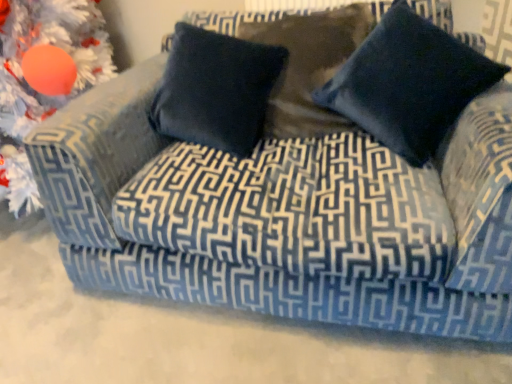
The height and width of the screenshot is (384, 512). What do you see at coordinates (44, 77) in the screenshot?
I see `orange matte ornament at upper left` at bounding box center [44, 77].

Find the location of a particular element. The image size is (512, 384). navy velvet pillow at upper right, the 2th pillow in the left-to-right sequence is located at coordinates (409, 83).

Between navy velvet pillow at upper right, the 2th pillow in the left-to-right sequence, and orange matte ornament at upper left, which one is positioned in front?

navy velvet pillow at upper right, the 2th pillow in the left-to-right sequence, is closer to the camera.

Which object is thinner, navy velvet pillow at upper right, which ranks as the 1th pillow in right-to-left order, or orange matte ornament at upper left?

Thinner between the two is navy velvet pillow at upper right, which ranks as the 1th pillow in right-to-left order.

How different are the orientations of navy velvet pillow at upper right, which ranks as the 1th pillow in right-to-left order, and orange matte ornament at upper left in degrees?

19.2 degrees.

Considering the positions of objects navy velvet pillow at upper right, the 2th pillow in the left-to-right sequence, and orange matte ornament at upper left in the image provided, who is more to the right, navy velvet pillow at upper right, the 2th pillow in the left-to-right sequence, or orange matte ornament at upper left?

navy velvet pillow at upper right, the 2th pillow in the left-to-right sequence, is more to the right.

Who is smaller, navy blue velvet pillow at center, positioned as the second pillow in right-to-left order, or navy velvet pillow at upper right, the 2th pillow in the left-to-right sequence?

navy blue velvet pillow at center, positioned as the second pillow in right-to-left order, is smaller.

Is navy blue velvet pillow at center, the first pillow positioned from the left, shorter than navy velvet pillow at upper right, which ranks as the 1th pillow in right-to-left order?

Yes, navy blue velvet pillow at center, the first pillow positioned from the left, is shorter than navy velvet pillow at upper right, which ranks as the 1th pillow in right-to-left order.

Is navy blue velvet pillow at center, positioned as the second pillow in right-to-left order, at the right side of navy velvet pillow at upper right, the 2th pillow in the left-to-right sequence?

No, navy blue velvet pillow at center, positioned as the second pillow in right-to-left order, is not to the right of navy velvet pillow at upper right, the 2th pillow in the left-to-right sequence.

Which is in front, point (195, 54) or point (59, 68)?

Positioned in front is point (59, 68).

The height and width of the screenshot is (384, 512). In order to click on the 1st pillow located above the orange matte ornament at upper left (from a real-world perspective) in this screenshot , I will do [216, 90].

In terms of height, does navy blue velvet pillow at center, the first pillow positioned from the left, look taller or shorter compared to orange matte ornament at upper left?

In the image, navy blue velvet pillow at center, the first pillow positioned from the left, appears to be shorter than orange matte ornament at upper left.

Would you consider navy blue velvet pillow at center, positioned as the second pillow in right-to-left order, to be distant from orange matte ornament at upper left?

They are positioned close to each other.

Does navy velvet pillow at upper right, the 2th pillow in the left-to-right sequence, appear on the left side of navy blue velvet pillow at center, the first pillow positioned from the left?

Incorrect, navy velvet pillow at upper right, the 2th pillow in the left-to-right sequence, is not on the left side of navy blue velvet pillow at center, the first pillow positioned from the left.

Between navy velvet pillow at upper right, the 2th pillow in the left-to-right sequence, and navy blue velvet pillow at center, the first pillow positioned from the left, which one has larger width?

navy velvet pillow at upper right, the 2th pillow in the left-to-right sequence.

Considering the relative sizes of navy velvet pillow at upper right, the 2th pillow in the left-to-right sequence, and navy blue velvet pillow at center, positioned as the second pillow in right-to-left order, in the image provided, is navy velvet pillow at upper right, the 2th pillow in the left-to-right sequence, bigger than navy blue velvet pillow at center, positioned as the second pillow in right-to-left order,?

Correct, navy velvet pillow at upper right, the 2th pillow in the left-to-right sequence, is larger in size than navy blue velvet pillow at center, positioned as the second pillow in right-to-left order.

Which of these two, orange matte ornament at upper left or navy velvet pillow at upper right, the 2th pillow in the left-to-right sequence, is wider?

With larger width is orange matte ornament at upper left.

Is orange matte ornament at upper left in front of or behind navy velvet pillow at upper right, the 2th pillow in the left-to-right sequence, in the image?

Visually, orange matte ornament at upper left is located behind navy velvet pillow at upper right, the 2th pillow in the left-to-right sequence.

Is orange matte ornament at upper left facing towards navy velvet pillow at upper right, which ranks as the 1th pillow in right-to-left order?

No, orange matte ornament at upper left does not turn towards navy velvet pillow at upper right, which ranks as the 1th pillow in right-to-left order.

Is orange matte ornament at upper left directly adjacent to navy velvet pillow at upper right, the 2th pillow in the left-to-right sequence?

They are not placed beside each other.

Consider the image. Are orange matte ornament at upper left and navy blue velvet pillow at center, positioned as the second pillow in right-to-left order, located far from each other?

They are positioned close to each other.

Is orange matte ornament at upper left in front of or behind navy blue velvet pillow at center, positioned as the second pillow in right-to-left order, in the image?

In the image, orange matte ornament at upper left appears in front of navy blue velvet pillow at center, positioned as the second pillow in right-to-left order.

From the picture: In terms of height, does orange matte ornament at upper left look taller or shorter compared to navy blue velvet pillow at center, positioned as the second pillow in right-to-left order?

Considering their sizes, orange matte ornament at upper left has more height than navy blue velvet pillow at center, positioned as the second pillow in right-to-left order.

Considering the sizes of objects orange matte ornament at upper left and navy blue velvet pillow at center, positioned as the second pillow in right-to-left order, in the image provided, who is bigger, orange matte ornament at upper left or navy blue velvet pillow at center, positioned as the second pillow in right-to-left order,?

orange matte ornament at upper left.

Where is `christmas decoration on the left of the navy velvet pillow at upper right, the 2th pillow in the left-to-right sequence`? This screenshot has height=384, width=512. christmas decoration on the left of the navy velvet pillow at upper right, the 2th pillow in the left-to-right sequence is located at coordinates (44, 77).

In the image, there is a navy velvet pillow at upper right, the 2th pillow in the left-to-right sequence. What are the coordinates of `pillow above it (from the image's perspective)` in the screenshot? It's located at (216, 90).

Looking at the image, which one is located further to navy velvet pillow at upper right, which ranks as the 1th pillow in right-to-left order, navy blue velvet pillow at center, the first pillow positioned from the left, or orange matte ornament at upper left?

The object further to navy velvet pillow at upper right, which ranks as the 1th pillow in right-to-left order, is orange matte ornament at upper left.

From the picture: Estimate the real-world distances between objects in this image. Which object is further from orange matte ornament at upper left, navy blue velvet pillow at center, the first pillow positioned from the left, or navy velvet pillow at upper right, which ranks as the 1th pillow in right-to-left order?

navy velvet pillow at upper right, which ranks as the 1th pillow in right-to-left order.

Which object lies further to the anchor point navy velvet pillow at upper right, which ranks as the 1th pillow in right-to-left order, orange matte ornament at upper left or navy blue velvet pillow at center, the first pillow positioned from the left?

orange matte ornament at upper left is positioned further to the anchor navy velvet pillow at upper right, which ranks as the 1th pillow in right-to-left order.

In the scene shown: Based on their spatial positions, is navy velvet pillow at upper right, the 2th pillow in the left-to-right sequence, or orange matte ornament at upper left closer to navy blue velvet pillow at center, the first pillow positioned from the left?

Based on the image, navy velvet pillow at upper right, the 2th pillow in the left-to-right sequence, appears to be nearer to navy blue velvet pillow at center, the first pillow positioned from the left.

Which object lies nearer to the anchor point orange matte ornament at upper left, navy velvet pillow at upper right, the 2th pillow in the left-to-right sequence, or navy blue velvet pillow at center, positioned as the second pillow in right-to-left order?

navy blue velvet pillow at center, positioned as the second pillow in right-to-left order, is positioned closer to the anchor orange matte ornament at upper left.

From the image, which object appears to be nearer to navy blue velvet pillow at center, the first pillow positioned from the left, orange matte ornament at upper left or navy velvet pillow at upper right, the 2th pillow in the left-to-right sequence?

navy velvet pillow at upper right, the 2th pillow in the left-to-right sequence, is closer to navy blue velvet pillow at center, the first pillow positioned from the left.

The width and height of the screenshot is (512, 384). I want to click on pillow situated between orange matte ornament at upper left and navy velvet pillow at upper right, which ranks as the 1th pillow in right-to-left order, from left to right, so click(x=216, y=90).